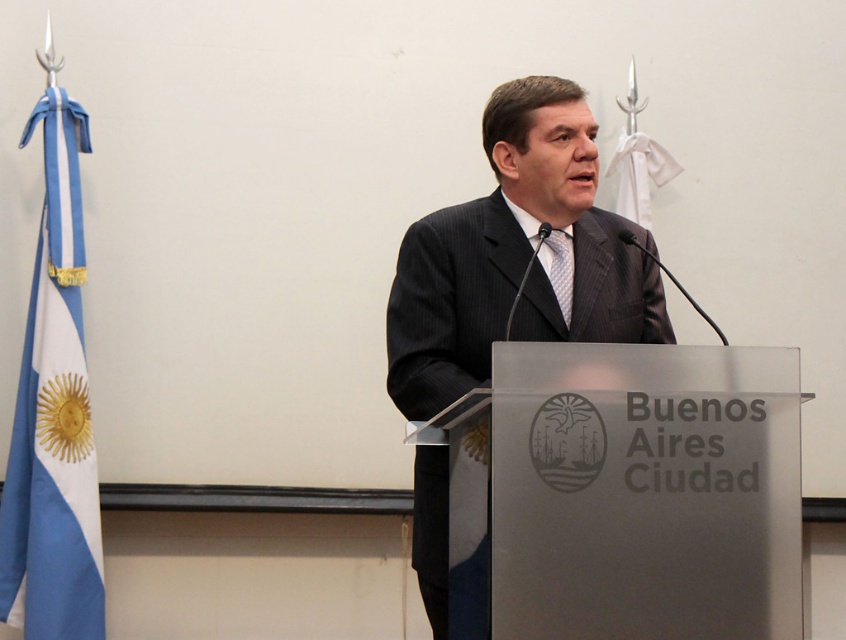
In the scene shown: Is blue fabric flag at left in front of blue dotted tie at center?

No, blue fabric flag at left is further to the viewer.

From the picture: Who is more distant from viewer, (74, 376) or (569, 248)?

The point (74, 376) is behind.

You are a GUI agent. You are given a task and a screenshot of the screen. Output one action in this format:
    pyautogui.click(x=<x>, y=<y>)
    Task: Click on the blue fabric flag at left
    The height and width of the screenshot is (640, 846).
    Given the screenshot: What is the action you would take?
    pyautogui.click(x=53, y=416)

Is dark gray suit at center shorter than blue dotted tie at center?

In fact, dark gray suit at center may be taller than blue dotted tie at center.

Is point (405, 276) positioned after point (569, 323)?

No, it is not.

Between point (597, 280) and point (555, 292), which one is positioned behind?

Point (597, 280)

This screenshot has height=640, width=846. Find the location of `dark gray suit at center`. dark gray suit at center is located at coordinates (515, 256).

How distant is dark gray suit at center from blue fabric flag at left?

dark gray suit at center is 1.69 meters away from blue fabric flag at left.

Does dark gray suit at center have a greater width compared to blue fabric flag at left?

Indeed, dark gray suit at center has a greater width compared to blue fabric flag at left.

Where is `dark gray suit at center`? dark gray suit at center is located at coordinates (515, 256).